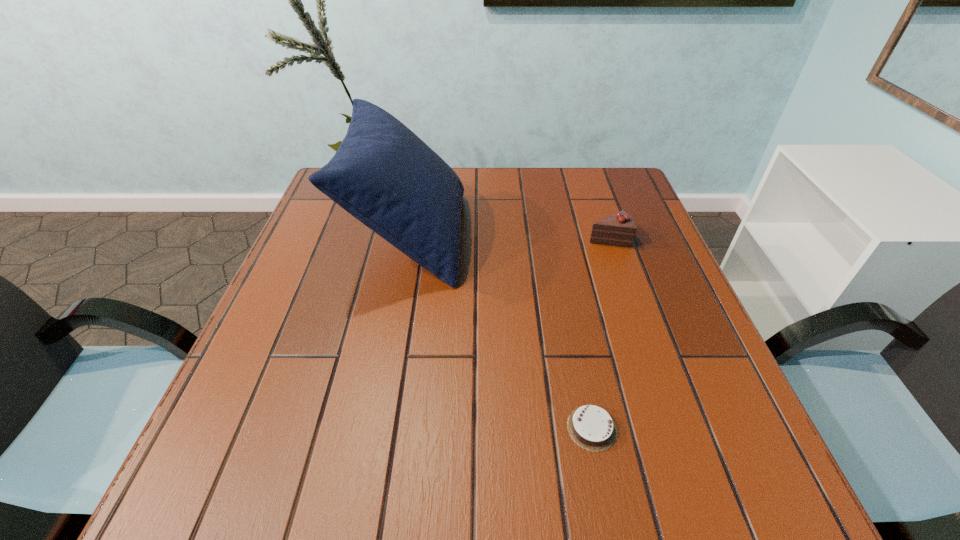
In order to click on vacant space that is in between the leftmost object and the rightmost object in this screenshot , I will do `click(509, 237)`.

You are a GUI agent. You are given a task and a screenshot of the screen. Output one action in this format:
    pyautogui.click(x=<x>, y=<y>)
    Task: Click on the free point between the taller chocolate cake and the cushion
    
    Given the screenshot: What is the action you would take?
    pyautogui.click(x=509, y=237)

This screenshot has height=540, width=960. Find the location of `free area in between the taller chocolate cake and the nearest object`. free area in between the taller chocolate cake and the nearest object is located at coordinates (600, 333).

You are a GUI agent. You are given a task and a screenshot of the screen. Output one action in this format:
    pyautogui.click(x=<x>, y=<y>)
    Task: Click on the blank region between the cushion and the left chocolate cake
    
    Given the screenshot: What is the action you would take?
    pyautogui.click(x=501, y=332)

Identify the location of free point between the left chocolate cake and the tallest object. (501, 332).

You are a GUI agent. You are given a task and a screenshot of the screen. Output one action in this format:
    pyautogui.click(x=<x>, y=<y>)
    Task: Click on the free spot between the taller chocolate cake and the nearest object
    This screenshot has width=960, height=540.
    Given the screenshot: What is the action you would take?
    pyautogui.click(x=600, y=333)

Where is `free space that is in between the tallest object and the rightmost object`? The image size is (960, 540). free space that is in between the tallest object and the rightmost object is located at coordinates (509, 237).

Find the location of a particular element. This screenshot has width=960, height=540. vacant area between the taller chocolate cake and the left chocolate cake is located at coordinates (600, 333).

In order to click on vacant space in between the shorter chocolate cake and the farther chocolate cake in this screenshot , I will do `click(600, 333)`.

Locate which object ranks second in proximity to the cushion. Please provide its 2D coordinates. Your answer should be formatted as a tuple, i.e. [(x, y)], where the tuple contains the x and y coordinates of a point satisfying the conditions above.

[(591, 427)]